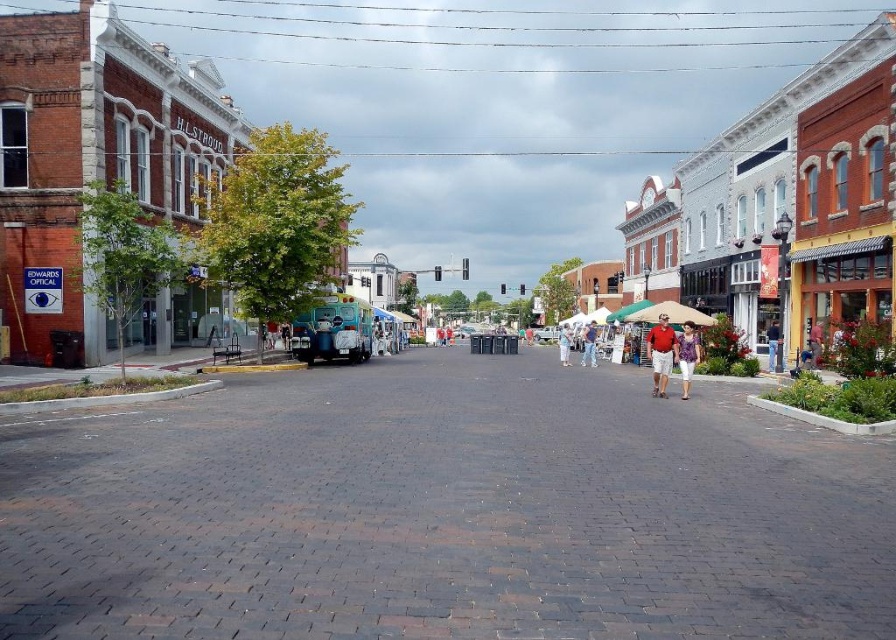
From the picture: You are a delivery person carrying a package and need to walk on the dark brick pavement at center while avoiding stepping on the light blue denim shorts at center. Is there enough space to walk without touching the shorts?

The dark brick pavement at center is wider than the light blue denim shorts at center, so there is sufficient space to walk on the pavement without touching the shorts.

You are a photographer standing on the sidewalk of a brick street. You notice two people walking towards you wearing a matte red shirt at center and a purple textured blouse at center. Which clothing item appears bigger in your camera viewfinder?

The matte red shirt at center appears bigger in the camera viewfinder because it is larger in size than the purple textured blouse at center.

You are standing on the sidewalk in the urban street scene. You see the light blue denim shorts at center and the matte teal van at center. How far apart are these two items?

The light blue denim shorts at center is 19.38 meters from matte teal van at center.